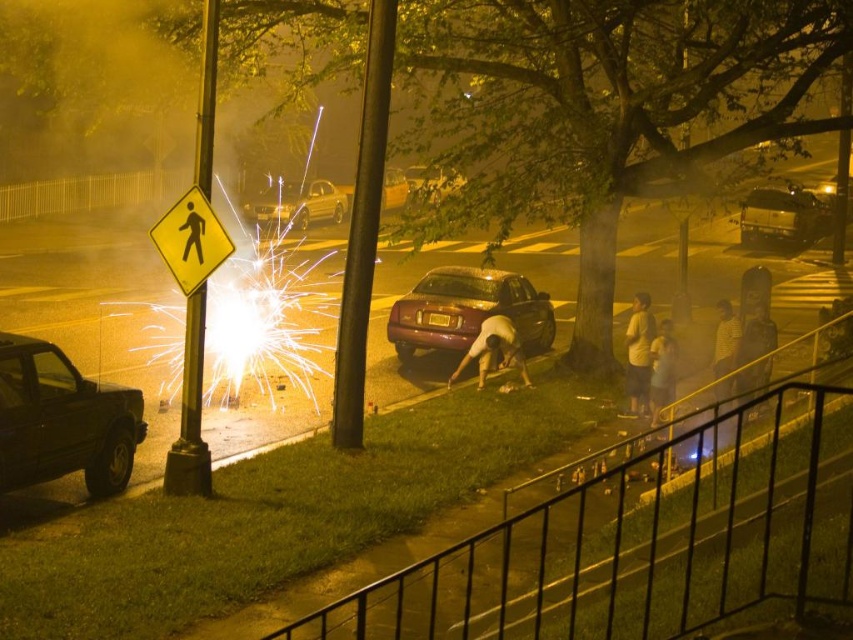
Question: Is maroon metallic sedan at center to the right of metallic silver sedan at center from the viewer's perspective?

Choices:
 (A) no
 (B) yes

Answer: (A)

Question: Which object is positioned farthest from the light blue jeans at lower center?

Choices:
 (A) yellow matte pedestrian sign at left
 (B) metallic maroon sedan at center

Answer: (B)

Question: Observing the image, what is the correct spatial positioning of light blue jeans at lower center in reference to metallic maroon sedan at center?

Choices:
 (A) right
 (B) left

Answer: (A)

Question: Which object is farther from the camera taking this photo?

Choices:
 (A) white cotton shirt at center
 (B) silver metallic sedan at upper center
 (C) maroon metallic sedan at center
 (D) yellow striped shirt at lower right

Answer: (B)

Question: Which object appears closest to the camera in this image?

Choices:
 (A) light blue jeans at lower center
 (B) metallic maroon sedan at center
 (C) shiny metallic sedan at center

Answer: (B)

Question: Does maroon metallic sedan at center come in front of light brown leather jacket at lower right?

Choices:
 (A) yes
 (B) no

Answer: (B)